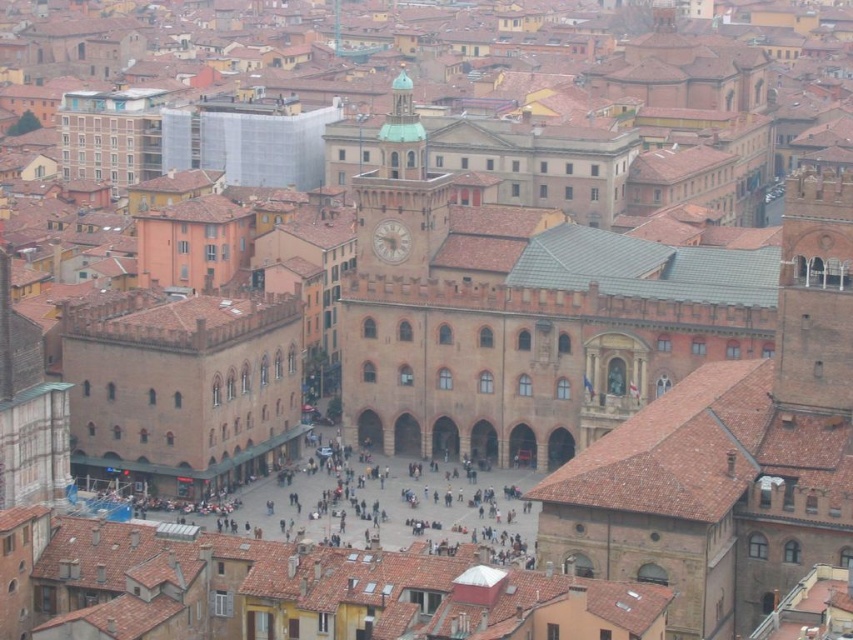
What do you see at coordinates (387, 506) in the screenshot? I see `dark gray stone plaza at center` at bounding box center [387, 506].

Is dark gray stone plaza at center bigger than green-tiled clock tower at center?

Correct, dark gray stone plaza at center is larger in size than green-tiled clock tower at center.

Between point (352, 477) and point (422, 256), which one is positioned in front?

Point (352, 477) is more forward.

Locate an element on the screen. Image resolution: width=853 pixels, height=640 pixels. dark gray stone plaza at center is located at coordinates (387, 506).

Does point (390, 230) come in front of point (403, 257)?

Yes, it is.

Does green-tiled clock tower at center appear under white marble clock at center?

No.

Where is `green-tiled clock tower at center`? Image resolution: width=853 pixels, height=640 pixels. green-tiled clock tower at center is located at coordinates (399, 196).

Who is taller, dark gray stone plaza at center or white marble clock at center?

Standing taller between the two is dark gray stone plaza at center.

Is point (274, 534) positioned after point (409, 241)?

No.

Locate an element on the screen. The width and height of the screenshot is (853, 640). dark gray stone plaza at center is located at coordinates (387, 506).